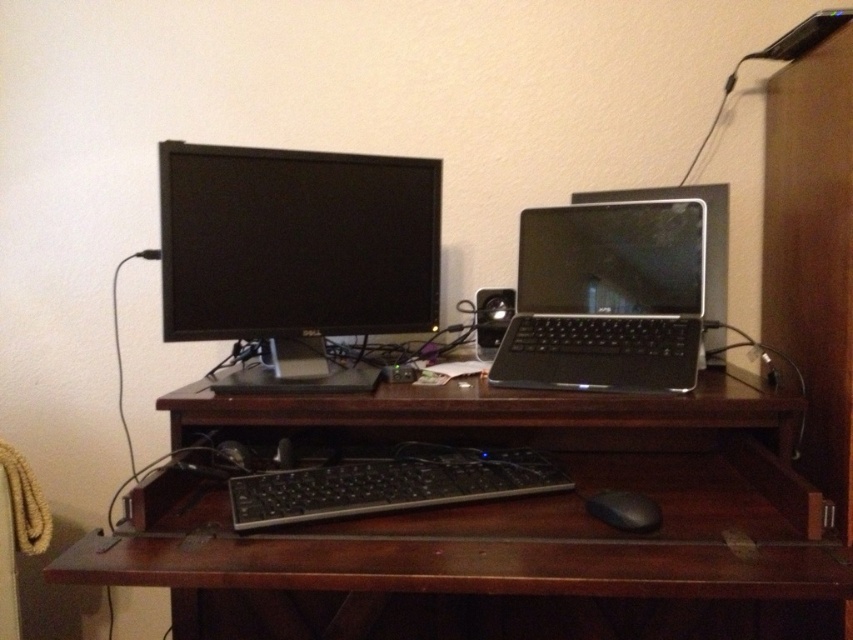
Question: Can you confirm if black matte laptop at center is positioned to the right of black plastic keyboard at center?

Choices:
 (A) no
 (B) yes

Answer: (B)

Question: Which of the following is the farthest from the observer?

Choices:
 (A) (488, 349)
 (B) (689, 321)
 (C) (461, 486)
 (D) (653, 500)

Answer: (A)

Question: Can you confirm if black matte laptop at center is smaller than black plastic speaker at center?

Choices:
 (A) no
 (B) yes

Answer: (A)

Question: Which point is closer to the camera taking this photo?

Choices:
 (A) (567, 449)
 (B) (401, 300)

Answer: (B)

Question: Can you confirm if dark wood table at center is wider than black rubber mouse at lower right?

Choices:
 (A) no
 (B) yes

Answer: (B)

Question: Estimate the real-world distances between objects in this image. Which object is farther from the black matte laptop at center?

Choices:
 (A) black plastic speaker at center
 (B) dark wood table at center

Answer: (B)